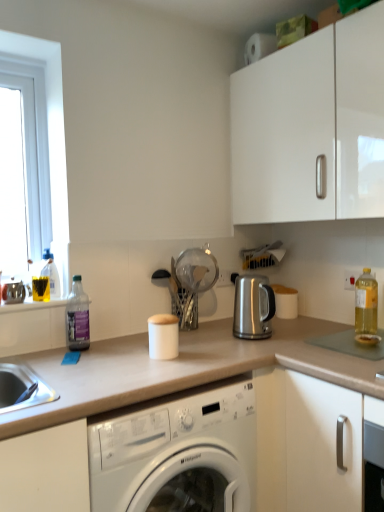
Where is `free space to the back side of satin silver kettle at center, the third appliance in the left-to-right sequence`? Image resolution: width=384 pixels, height=512 pixels. free space to the back side of satin silver kettle at center, the third appliance in the left-to-right sequence is located at coordinates (269, 325).